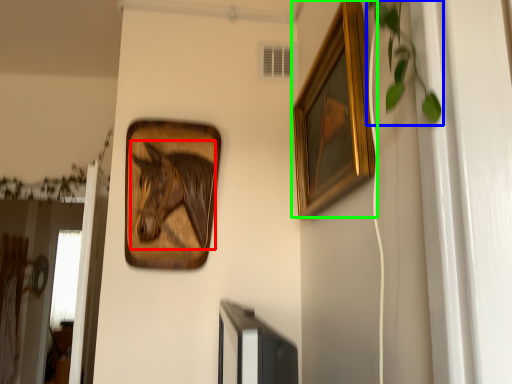
Question: Considering the real-world distances, which object is farthest from animal (highlighted by a red box)? plant (highlighted by a blue box) or picture frame (highlighted by a green box)?

Choices:
 (A) plant
 (B) picture frame

Answer: (A)